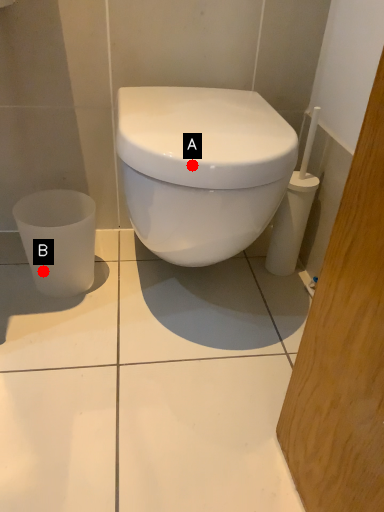
Question: Two points are circled on the image, labeled by A and B beside each circle. Which point is closer to the camera taking this photo?

Choices:
 (A) A is closer
 (B) B is closer

Answer: (A)